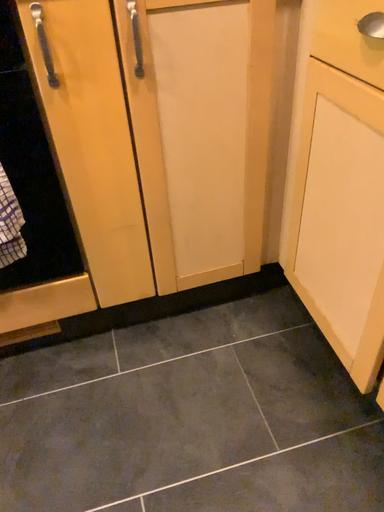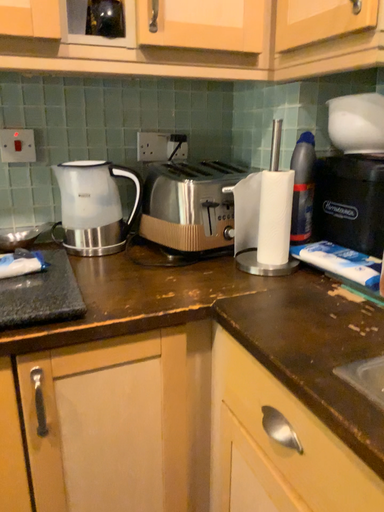
Question: Which way did the camera rotate in the video?

Choices:
 (A) rotated downward
 (B) rotated upward

Answer: (B)